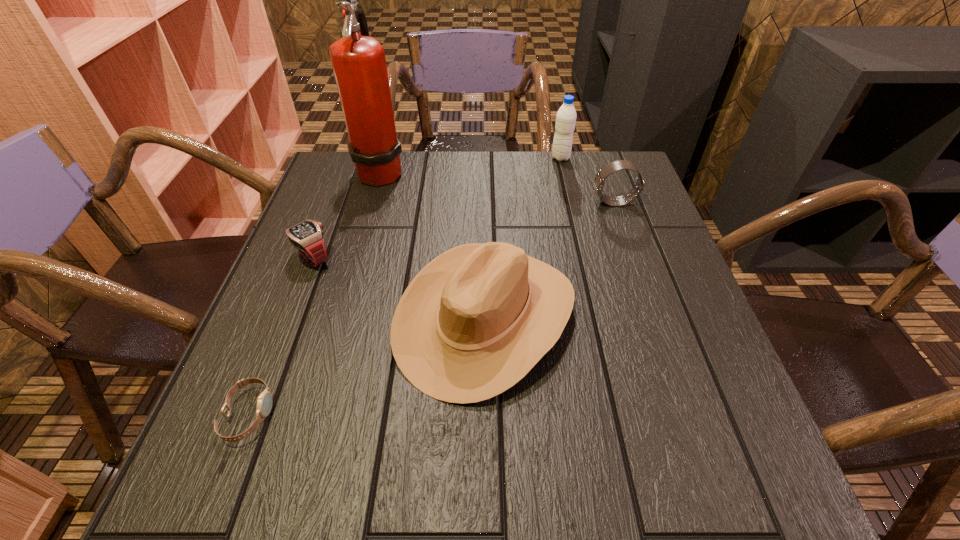
This screenshot has width=960, height=540. Identify the location of water bottle at the far edge. (566, 116).

I want to click on watch present at the far edge, so click(x=612, y=167).

At what (x,y) coordinates should I click in order to perform the action: click on fire extinguisher at the left edge. Please return your answer as a coordinate pair (x, y). Looking at the image, I should click on (359, 64).

Identify the location of object present at the right edge. (612, 167).

Image resolution: width=960 pixels, height=540 pixels. Find the location of `object located in the far left corner section of the desktop`. object located in the far left corner section of the desktop is located at coordinates (359, 64).

You are a GUI agent. You are given a task and a screenshot of the screen. Output one action in this format:
    pyautogui.click(x=<x>, y=<y>)
    Task: Click on the object that is at the far right corner
    This screenshot has height=540, width=960.
    Given the screenshot: What is the action you would take?
    pyautogui.click(x=612, y=167)

The height and width of the screenshot is (540, 960). I want to click on vacant area at the far edge, so click(419, 169).

The height and width of the screenshot is (540, 960). Identify the location of blank space at the near edge. (574, 453).

This screenshot has width=960, height=540. In the image, there is a desktop. Identify the location of free space at the left edge. (319, 295).

At what (x,y) coordinates should I click in order to perform the action: click on vacant space at the right edge of the desktop. Please return your answer as a coordinate pair (x, y). This screenshot has height=540, width=960. Looking at the image, I should click on (665, 361).